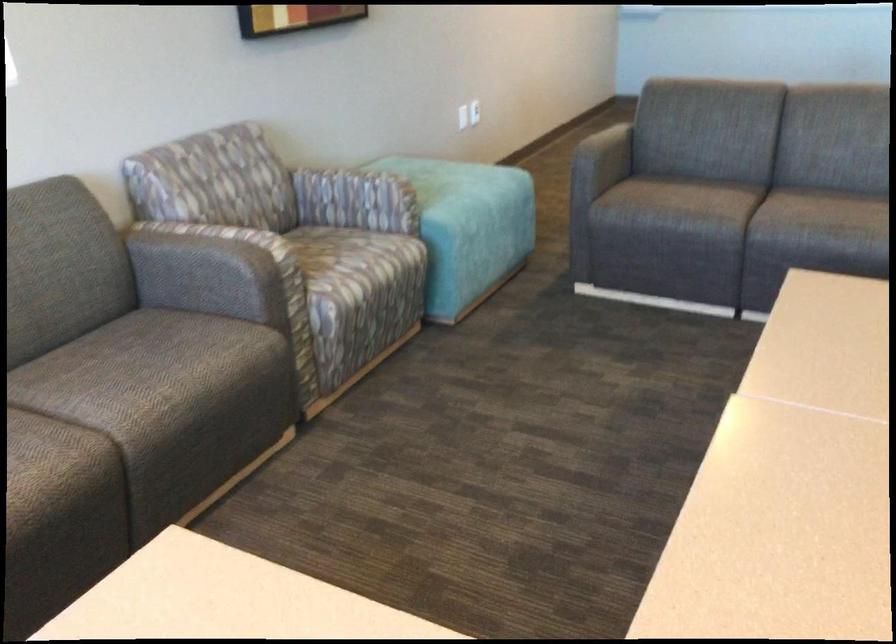
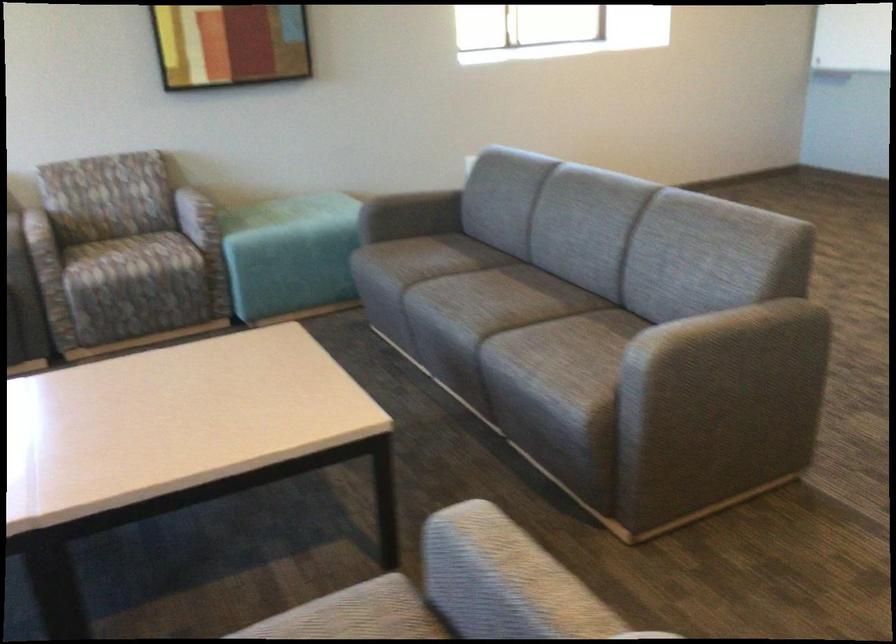
Locate, in the second image, the point that corresponds to pixel 326 263 in the first image.

(125, 259)